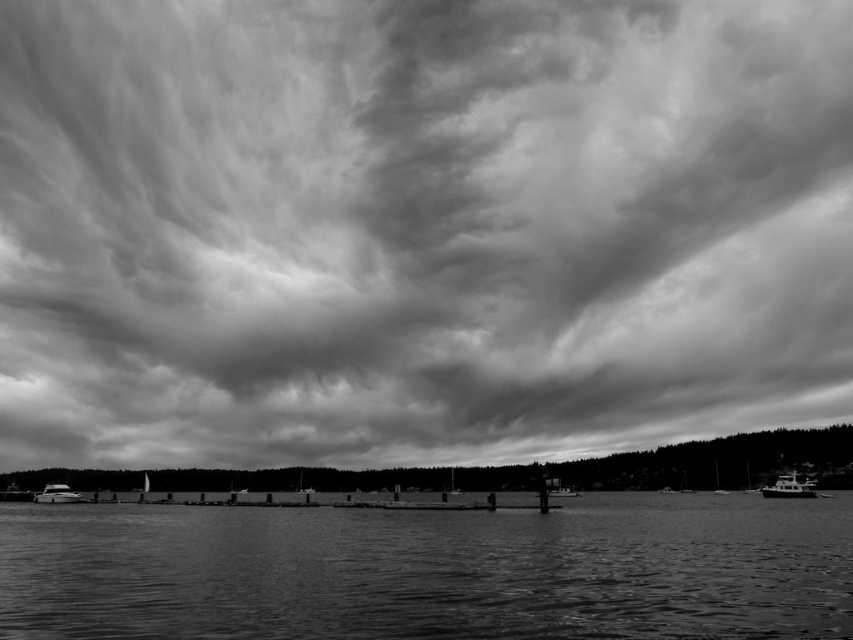
You are a photographer planning to capture the cloudy sky at upper center and the metallic silver boat at lower left in the same frame. Based on the scene, can you fit both elements into your camera viewfinder without moving your position?

The cloudy sky at upper center is much taller than the metallic silver boat at lower left, so yes, both elements can be captured in the same frame as the sky occupies a larger portion of the scene.

You are standing at the edge of the waterfront scene and see the smooth water at center and the metallic silver boat at lower left. Which object is closer to your right side?

The smooth water at center is to the right of the metallic silver boat at lower left, so the smooth water at center is closer to your right side.